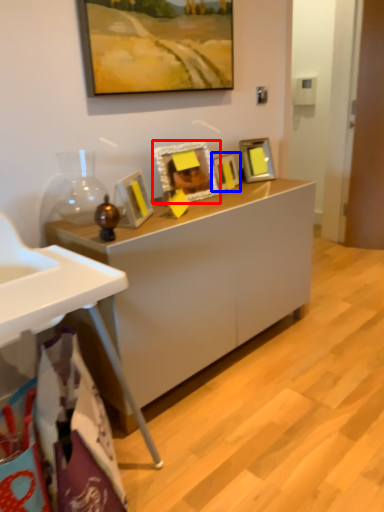
Question: Which object is closer to the camera taking this photo, picture frame (highlighted by a red box) or picture frame (highlighted by a blue box)?

Choices:
 (A) picture frame
 (B) picture frame

Answer: (A)